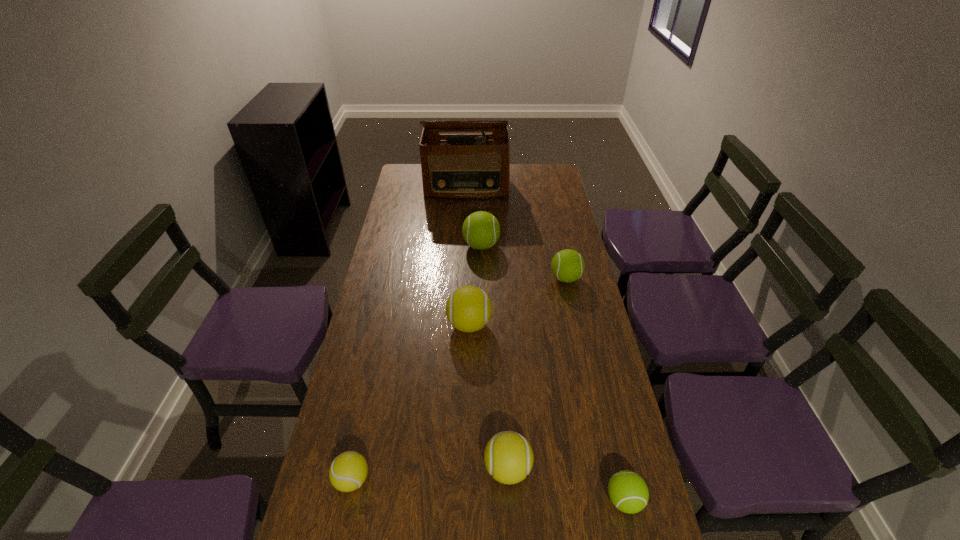
Locate an element on the screen. radio receiver is located at coordinates (454, 166).

This screenshot has width=960, height=540. I want to click on the tallest object, so click(454, 166).

The image size is (960, 540). What are the coordinates of `the farthest green tennis ball` in the screenshot? It's located at (481, 230).

Locate an element on the screen. The height and width of the screenshot is (540, 960). the second farthest object is located at coordinates (481, 230).

This screenshot has width=960, height=540. I want to click on the fourth nearest object, so click(468, 308).

This screenshot has width=960, height=540. In order to click on the fourth nearest tennis ball in this screenshot , I will do 468,308.

Identify the location of the fifth nearest object. (567, 265).

The width and height of the screenshot is (960, 540). I want to click on the second smallest green tennis ball, so click(567, 265).

Find the location of a particular element. The image size is (960, 540). the second biggest yellow tennis ball is located at coordinates (508, 457).

Find the location of `the leftmost object`. the leftmost object is located at coordinates (348, 471).